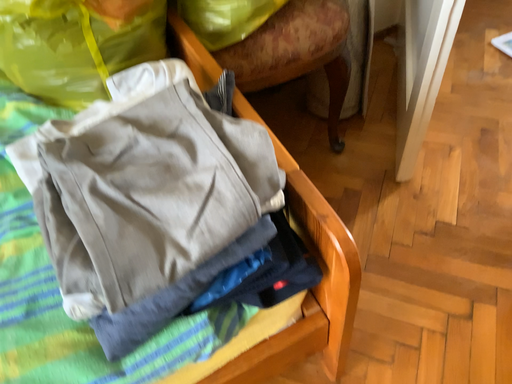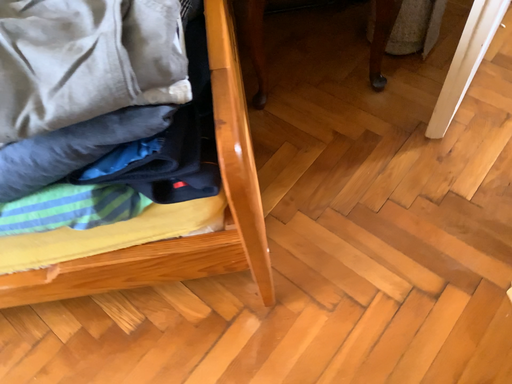
Question: Which way did the camera rotate in the video?

Choices:
 (A) rotated left
 (B) rotated right

Answer: (A)